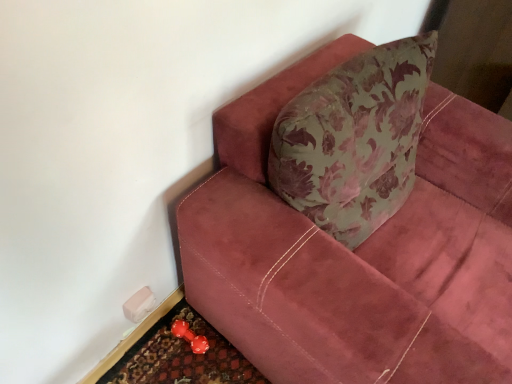
What do you see at coordinates (182, 356) in the screenshot? I see `rubberized red doormat at lower left` at bounding box center [182, 356].

The width and height of the screenshot is (512, 384). Describe the element at coordinates (358, 252) in the screenshot. I see `velvet maroon couch at upper right` at that location.

In order to face rubberized red dumbbell at lower left, should I rotate leftwards or rightwards?

You should look left and rotate roughly 8.880 degrees.

You are a GUI agent. You are given a task and a screenshot of the screen. Output one action in this format:
    pyautogui.click(x=<x>, y=<y>)
    Task: Click on the rubberized red doormat at lower left
    
    Given the screenshot: What is the action you would take?
    pyautogui.click(x=182, y=356)

Based on the photo, in terms of size, does rubberized red doormat at lower left appear bigger or smaller than velvet maroon couch at upper right?

Considering their sizes, rubberized red doormat at lower left takes up less space than velvet maroon couch at upper right.

Considering the positions of objects rubberized red doormat at lower left and velvet maroon couch at upper right in the image provided, who is more to the right, rubberized red doormat at lower left or velvet maroon couch at upper right?

Positioned to the right is velvet maroon couch at upper right.

Is rubberized red dumbbell at lower left looking in the opposite direction of rubberized red doormat at lower left?

That's not correct — rubberized red dumbbell at lower left is not looking away from rubberized red doormat at lower left.

Which object is closer to the camera taking this photo, rubberized red dumbbell at lower left or rubberized red doormat at lower left?

rubberized red doormat at lower left is in front.

Does point (177, 323) appear closer or farther from the camera than point (150, 335)?

Point (177, 323) appears to be farther away from the viewer than point (150, 335).

Considering the relative sizes of rubberized red dumbbell at lower left and rubberized red doormat at lower left in the image provided, is rubberized red dumbbell at lower left bigger than rubberized red doormat at lower left?

No.

Does rubberized red doormat at lower left turn towards rubberized red dumbbell at lower left?

No, rubberized red doormat at lower left is not facing towards rubberized red dumbbell at lower left.

Considering the sizes of objects rubberized red doormat at lower left and rubberized red dumbbell at lower left in the image provided, who is thinner, rubberized red doormat at lower left or rubberized red dumbbell at lower left?

With smaller width is rubberized red dumbbell at lower left.

From a real-world perspective, relative to rubberized red dumbbell at lower left, is rubberized red doormat at lower left vertically above or below?

In terms of real-world spatial position, rubberized red doormat at lower left is below rubberized red dumbbell at lower left.

Between point (474, 339) and point (234, 348), which one is positioned behind?

The point (234, 348) is behind.

Is velvet maroon couch at upper right not near rubberized red doormat at lower left?

They are positioned close to each other.

Looking at this image, which is in front, velvet maroon couch at upper right or rubberized red doormat at lower left?

velvet maroon couch at upper right is closer to the camera.

Would you say velvet maroon couch at upper right is to the left or to the right of rubberized red doormat at lower left in the picture?

Based on their positions, velvet maroon couch at upper right is located to the right of rubberized red doormat at lower left.

Who is more distant, rubberized red dumbbell at lower left or velvet maroon couch at upper right?

Positioned behind is rubberized red dumbbell at lower left.

Which is nearer, (174, 325) or (407, 257)?

Clearly, point (174, 325) is more distant from the camera than point (407, 257).

Considering the relative positions of rubberized red dumbbell at lower left and velvet maroon couch at upper right in the image provided, is rubberized red dumbbell at lower left to the right of velvet maroon couch at upper right from the viewer's perspective?

In fact, rubberized red dumbbell at lower left is to the left of velvet maroon couch at upper right.

In the scene shown: Measure the distance from velvet maroon couch at upper right to rubberized red dumbbell at lower left.

velvet maroon couch at upper right is 27.10 inches from rubberized red dumbbell at lower left.

Is velvet maroon couch at upper right taller or shorter than rubberized red dumbbell at lower left?

velvet maroon couch at upper right is taller than rubberized red dumbbell at lower left.

Is velvet maroon couch at upper right not close to rubberized red dumbbell at lower left?

That's not correct — velvet maroon couch at upper right is a little close to rubberized red dumbbell at lower left.

Is velvet maroon couch at upper right positioned beyond the bounds of rubberized red dumbbell at lower left?

Yes.

Image resolution: width=512 pixels, height=384 pixels. I want to click on doormat behind the velvet maroon couch at upper right, so click(182, 356).

Locate an element on the screen. doormat directly beneath the rubberized red dumbbell at lower left (from a real-world perspective) is located at coordinates (182, 356).

Considering their positions, is rubberized red doormat at lower left positioned further to rubberized red dumbbell at lower left than velvet maroon couch at upper right?

velvet maroon couch at upper right is positioned further to the anchor rubberized red dumbbell at lower left.

From the picture: Looking at the image, which one is located closer to velvet maroon couch at upper right, rubberized red doormat at lower left or rubberized red dumbbell at lower left?

rubberized red doormat at lower left lies closer to velvet maroon couch at upper right than the other object.

From the image, which object appears to be nearer to rubberized red dumbbell at lower left, velvet maroon couch at upper right or rubberized red doormat at lower left?

rubberized red doormat at lower left lies closer to rubberized red dumbbell at lower left than the other object.

Consider the image. Which object lies nearer to the anchor point rubberized red doormat at lower left, velvet maroon couch at upper right or rubberized red dumbbell at lower left?

The object closer to rubberized red doormat at lower left is rubberized red dumbbell at lower left.

Which object lies nearer to the anchor point rubberized red doormat at lower left, rubberized red dumbbell at lower left or velvet maroon couch at upper right?

rubberized red dumbbell at lower left is closer to rubberized red doormat at lower left.

Looking at the image, which one is located further to velvet maroon couch at upper right, rubberized red dumbbell at lower left or rubberized red doormat at lower left?

Based on the image, rubberized red dumbbell at lower left appears to be further to velvet maroon couch at upper right.

Where is `doormat between velvet maroon couch at upper right and rubberized red dumbbell at lower left from front to back`? doormat between velvet maroon couch at upper right and rubberized red dumbbell at lower left from front to back is located at coordinates (182, 356).